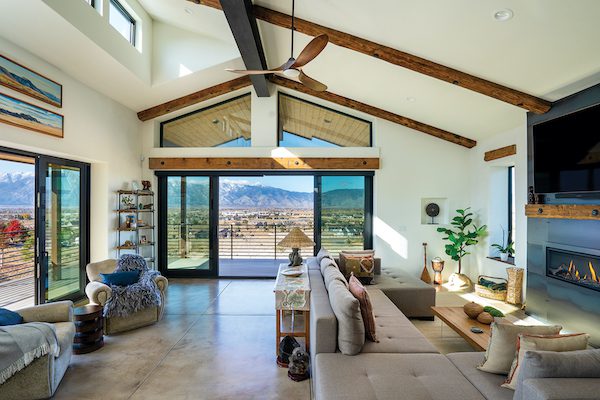
Where is `windows in the back`? windows in the back is located at coordinates (276, 208), (348, 203), (196, 213).